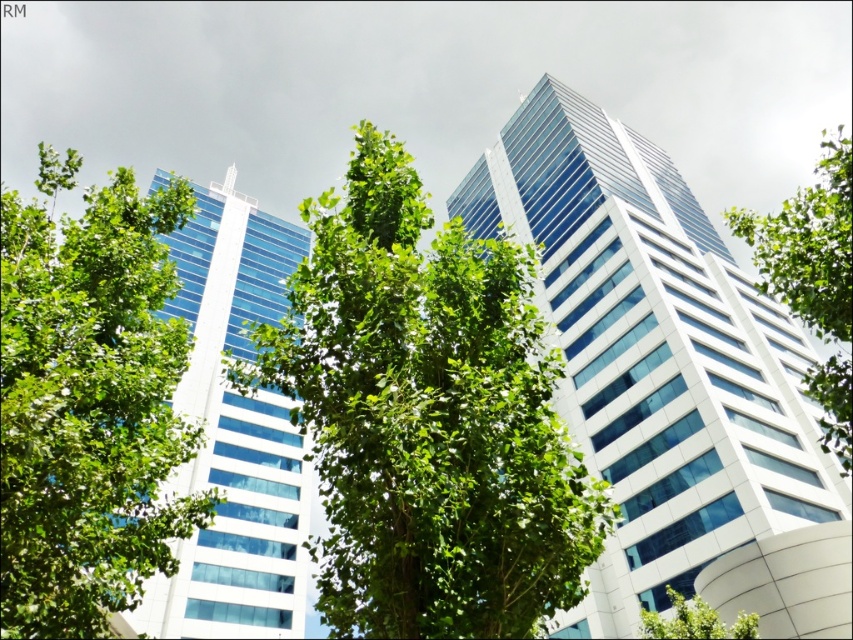
You are an architect analyzing the urban layout. Given the glassy white skyscraper at center and the glassy blue skyscraper at left, which one appears lower in the image?

The glassy white skyscraper at center appears lower because it is positioned below the glassy blue skyscraper at left.

Based on the photo, you are standing in the urban landscape and want to locate the point marked at coordinates (x=426, y=417). Based on the scene description, which object does this point lie on?

The point marked at coordinates (x=426, y=417) lies on the green leafy tree at center.